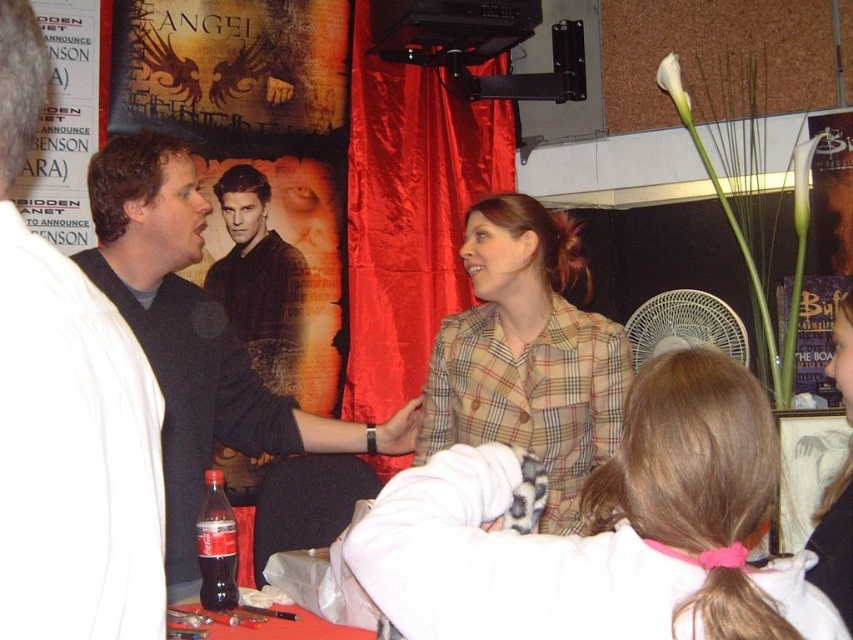
Is point (407, 449) in front of point (277, 262)?

Yes, it is.

Between matte black shirt at left and dark brown leather jacket at center, which one is positioned higher?

dark brown leather jacket at center

Who is more distant from viewer, (281, 435) or (293, 353)?

Positioned behind is point (293, 353).

You are a GUI agent. You are given a task and a screenshot of the screen. Output one action in this format:
    pyautogui.click(x=<x>, y=<y>)
    Task: Click on the matte black shirt at left
    The image size is (853, 640).
    Given the screenshot: What is the action you would take?
    click(215, 368)

Does pink hairband at center have a lesser width compared to dark brown leather jacket at center?

No, pink hairband at center is not thinner than dark brown leather jacket at center.

Is point (624, 502) positioned behind point (293, 308)?

No, it is not.

Identify the location of pink hairband at center. (602, 531).

Does point (822, 604) lie in front of point (218, 630)?

Yes, it is.

Which is behind, point (517, 602) or point (271, 621)?

Positioned behind is point (271, 621).

Identify the location of pink hairband at center. (602, 531).